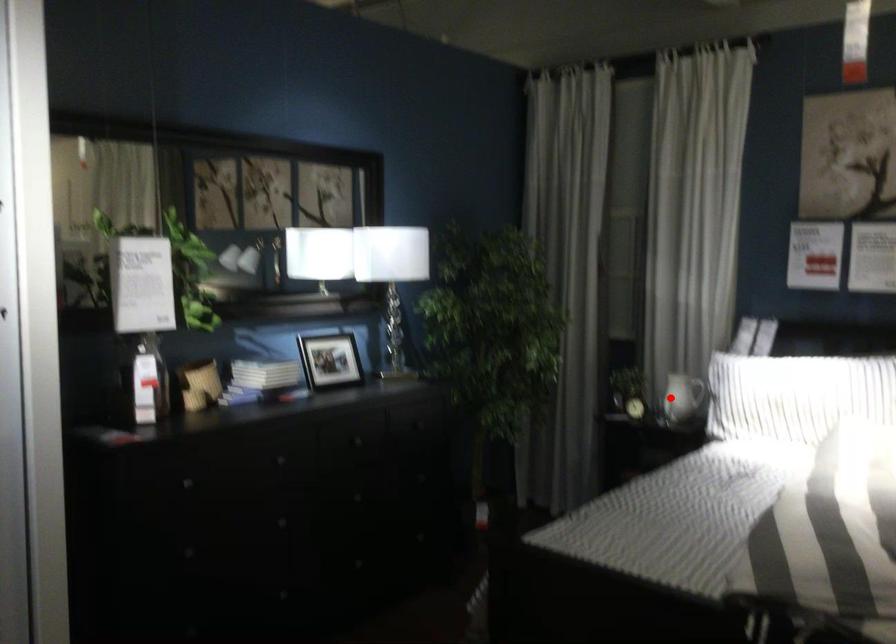
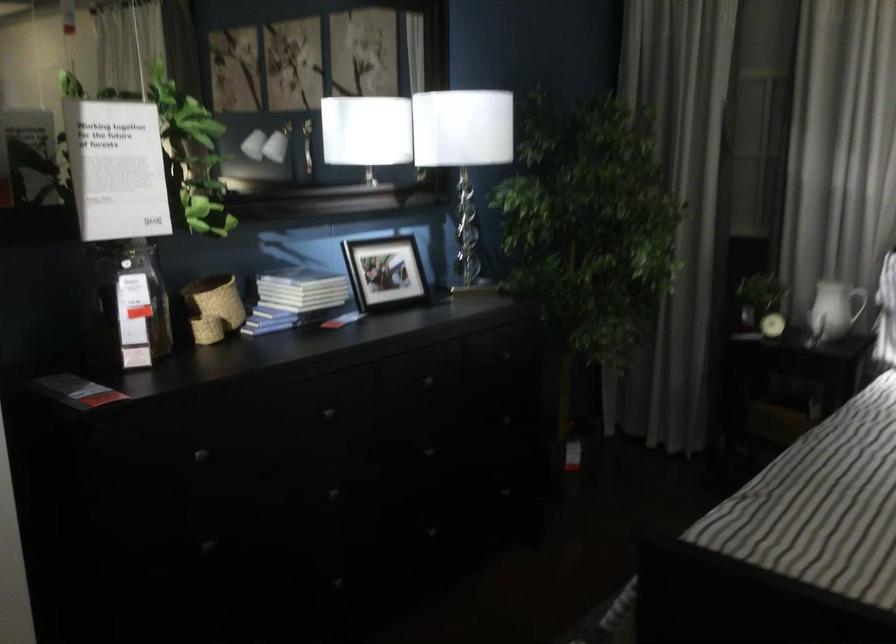
Question: A red point is marked in image1. In image2, is the corresponding 3D point closer to the camera or farther? Reply with the corresponding letter.

Choices:
 (A) The corresponding 3D point is closer.
 (B) The corresponding 3D point is farther.

Answer: (A)